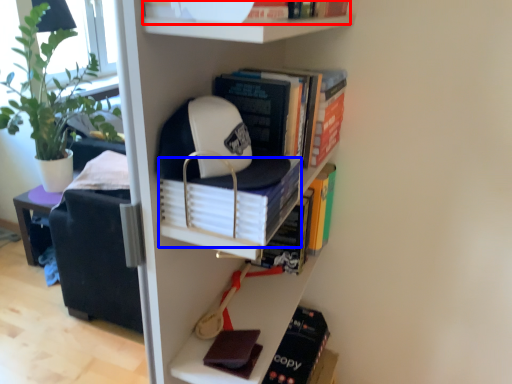
Question: Which object appears closest to the camera in this image, book (highlighted by a red box) or book (highlighted by a blue box)?

Choices:
 (A) book
 (B) book

Answer: (A)